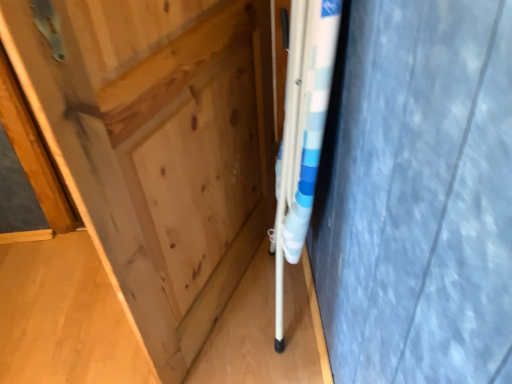
I want to click on vacant space positioned to the left of white plastic crutch at center, so click(x=244, y=311).